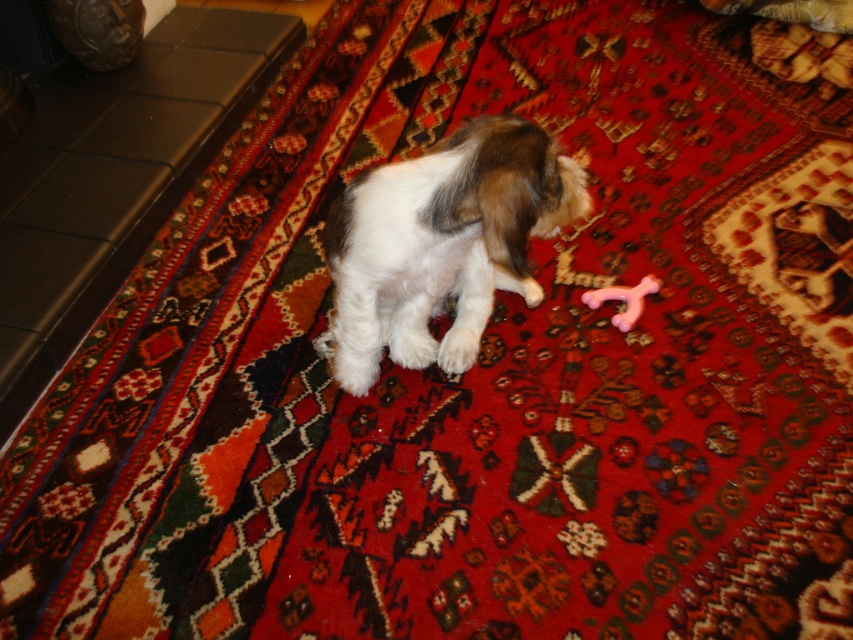
You are a pet owner who wants to throw a ball for your dog. You see the white fluffy dog at center and the pink rubber toy at center in the image. Which direction should you aim to toss the toy so the dog can chase it?

The white fluffy dog at center is located above the pink rubber toy at center, so you should aim to toss the toy downward from the dog to encourage it to chase the toy in that direction.

You are standing in a room with a patterned rug and a small dog. The dog is at point (x=440, y=244). There is a pink bone toy on the rug. If you want to move the pink bone toy closer to the dog, where should you place it?

The pink bone toy should be placed closer to point (x=440, y=244) where the white fluffy dog at center is located.